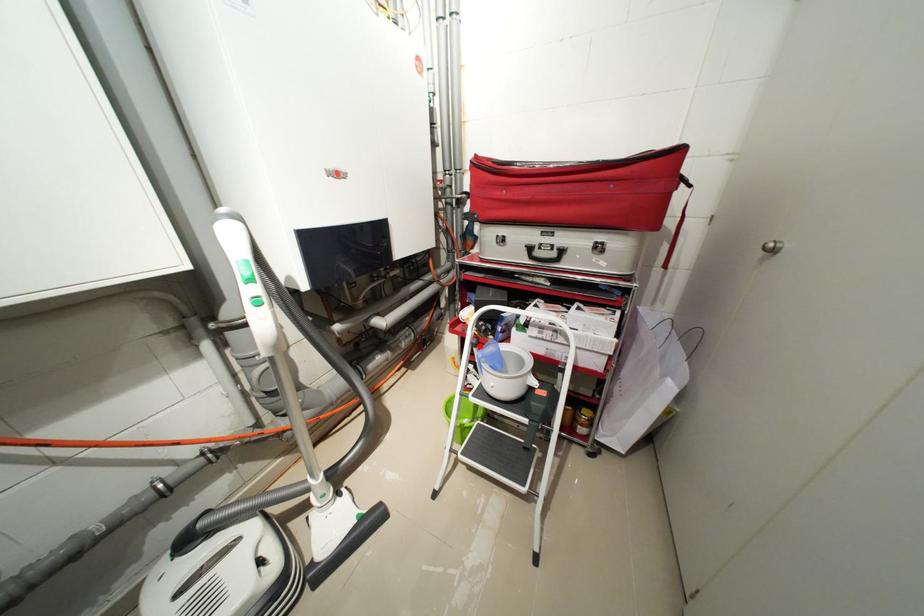
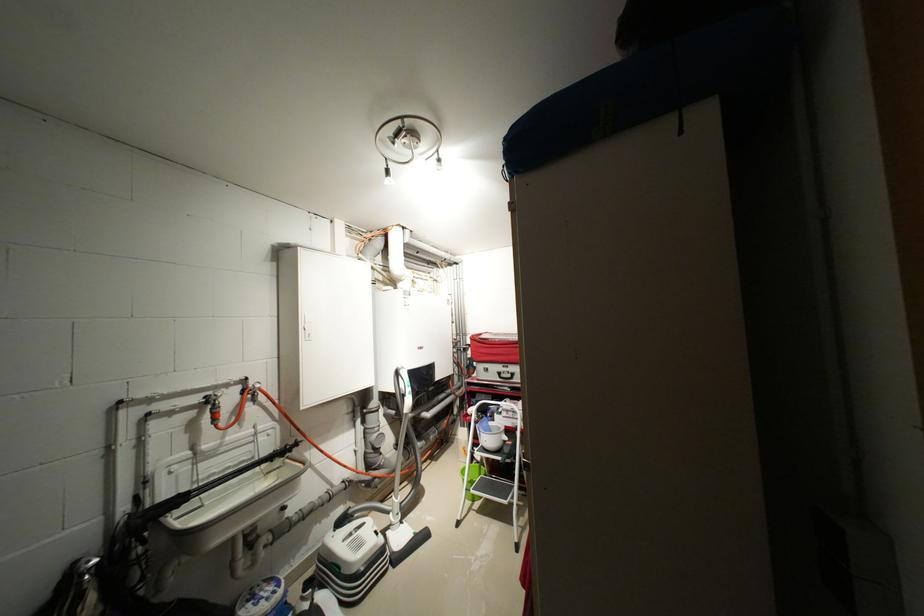
In the second image, find the point that corresponds to the highlighted location in the first image.

(482, 424)